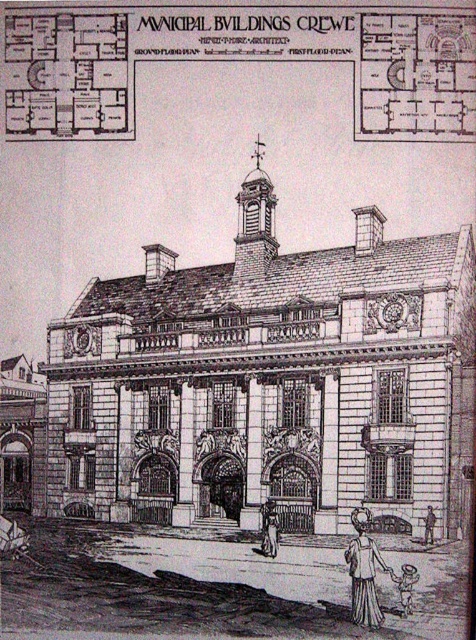
Question: Is smooth gray statue at center bigger than brown paper bag at lower right?

Choices:
 (A) no
 (B) yes

Answer: (B)

Question: Which is nearer to the smooth gray statue at center?

Choices:
 (A) stone textured church at center
 (B) brown paper bag at lower right
 (C) smooth skin person at lower right

Answer: (C)

Question: Which object appears closest to the camera in this image?

Choices:
 (A) smooth skin person at lower right
 (B) smooth gray statue at center
 (C) stone textured church at center

Answer: (A)

Question: Where is light brown wooden figure at lower right located in relation to brown paper bag at lower right in the image?

Choices:
 (A) right
 (B) left

Answer: (B)

Question: Does stone textured church at center lie behind smooth skin person at lower right?

Choices:
 (A) no
 (B) yes

Answer: (B)

Question: Which of the following is the farthest from the observer?

Choices:
 (A) stone textured church at center
 (B) light brown wooden figure at lower right
 (C) smooth gray statue at center
 (D) smooth skin person at lower right

Answer: (C)